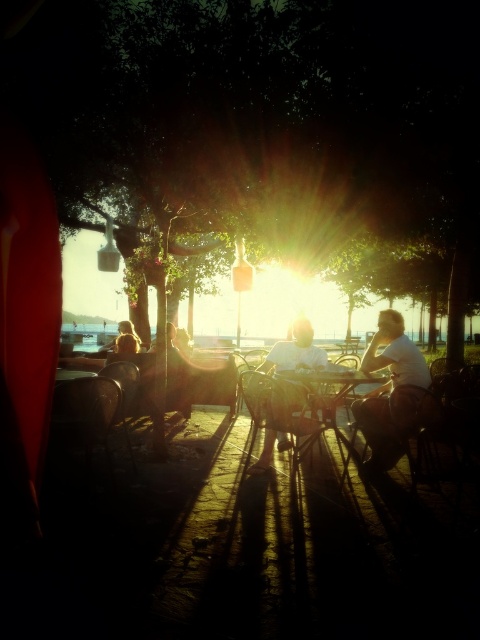
Which is in front, point (86, 388) or point (263, 452)?

Point (86, 388)

Between metallic silver chair at lower left and white shirt at center, which one has less height?

white shirt at center is shorter.

Identify the location of metallic silver chair at lower left. The image size is (480, 640). (87, 413).

Does white cotton shirt at right have a smaller size compared to blonde hair at left?

Yes, white cotton shirt at right is smaller than blonde hair at left.

Can you confirm if white cotton shirt at right is taller than blonde hair at left?

Yes, white cotton shirt at right is taller than blonde hair at left.

Who is more distant from viewer, (388,426) or (133,333)?

Point (133,333)

At what (x,y) coordinates should I click in order to perform the action: click on white cotton shirt at right. Please return your answer as a coordinate pair (x, y). This screenshot has width=480, height=640. Looking at the image, I should click on (388, 390).

Is metallic silver chair at lower left positioned at the back of metallic silver table at center?

No, metallic silver chair at lower left is closer to the viewer.

Does metallic silver chair at lower left appear over metallic silver table at center?

Yes, metallic silver chair at lower left is above metallic silver table at center.

Is point (71, 388) positioned after point (327, 372)?

No.

You are a GUI agent. You are given a task and a screenshot of the screen. Output one action in this format:
    pyautogui.click(x=<x>, y=<y>)
    Task: Click on the metallic silver chair at lower left
    Image resolution: width=480 pixels, height=640 pixels.
    Given the screenshot: What is the action you would take?
    pyautogui.click(x=87, y=413)